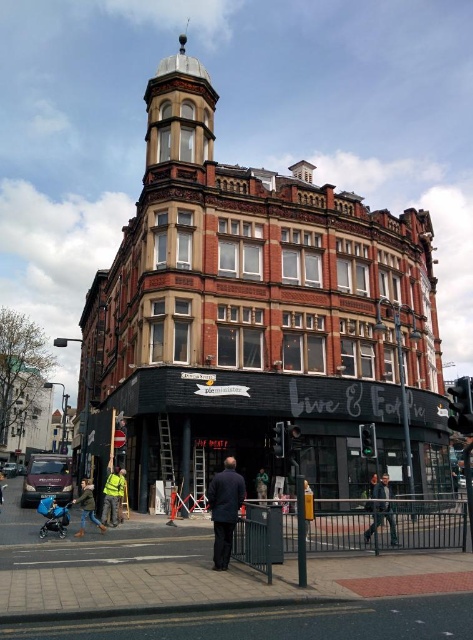
Question: Observing the image, what is the correct spatial positioning of dark blue jeans at lower center in reference to blue fabric baby carriage at lower left?

Choices:
 (A) above
 (B) below

Answer: (A)

Question: Which point appears closest to the camera in this image?

Choices:
 (A) pos(226,540)
 (B) pos(374,529)

Answer: (A)

Question: Does dark blue jeans at lower center lie in front of light blue denim jacket at lower left?

Choices:
 (A) yes
 (B) no

Answer: (A)

Question: Based on their relative distances, which object is farther from the light blue denim jacket at lower left?

Choices:
 (A) green camouflage jacket at center
 (B) yellow reflective vest at lower left
 (C) dark blue suit at center
 (D) blue fabric baby carriage at lower left

Answer: (A)

Question: Which object is positioned closest to the yellow reflective vest at lower left?

Choices:
 (A) light blue denim jacket at lower left
 (B) green camouflage jacket at center

Answer: (A)

Question: In this image, where is blue fabric baby carriage at lower left located relative to green camouflage jacket at center?

Choices:
 (A) below
 (B) above

Answer: (A)